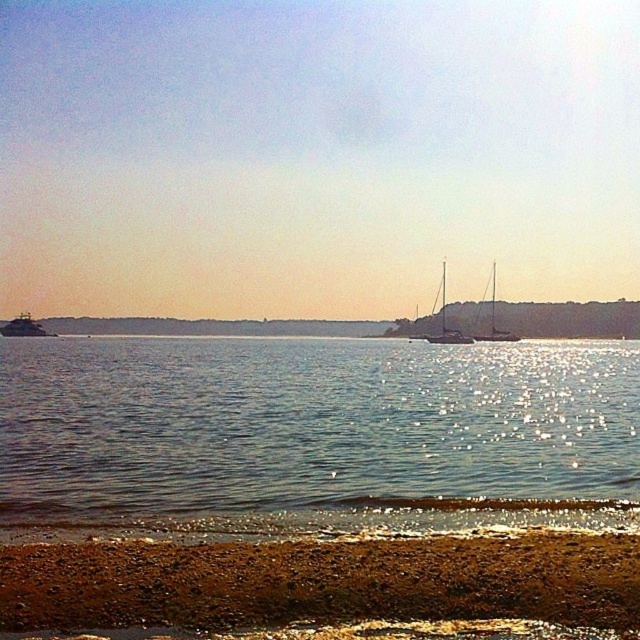
You are standing on the beach and want to walk from the brown gravelly sand at lower center to the white matte sailboat at right. Which direction should you head?

You should head to the right because the brown gravelly sand at lower center is to the left of the white matte sailboat at right.